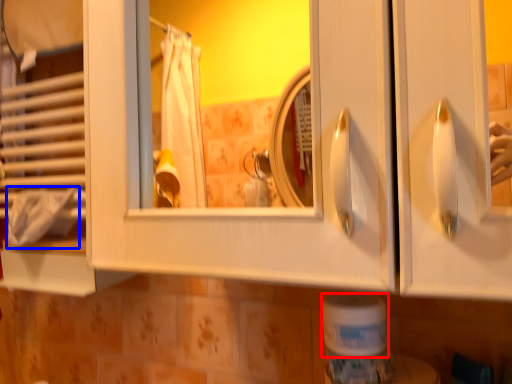
Question: Which object appears farthest to the camera in this image, toilet paper (highlighted by a red box) or bath towel (highlighted by a blue box)?

Choices:
 (A) toilet paper
 (B) bath towel

Answer: (B)